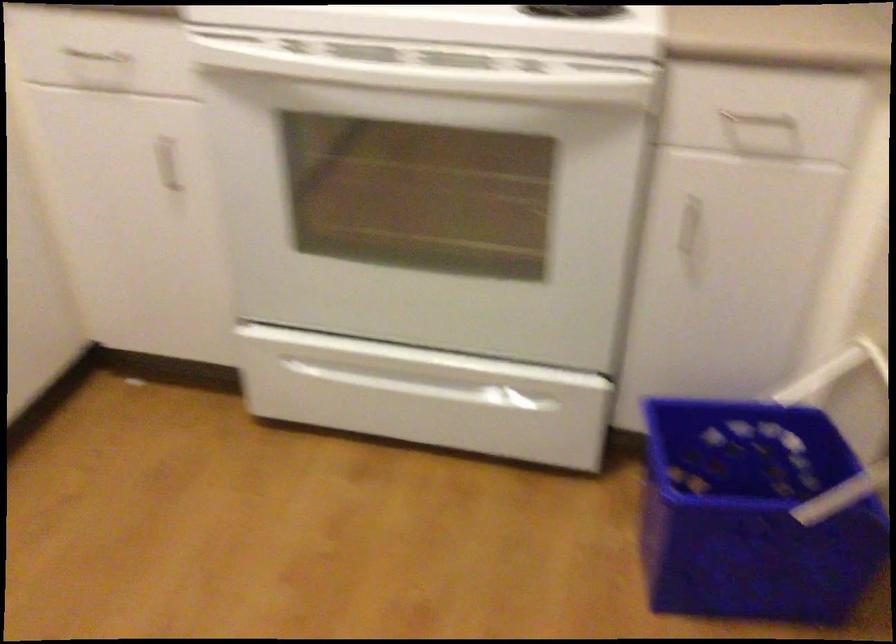
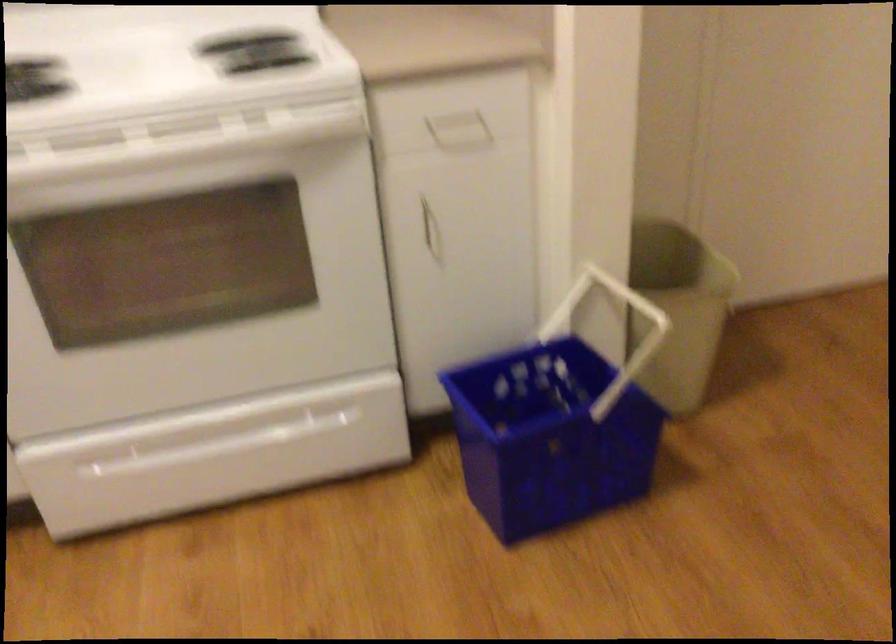
Locate, in the second image, the point that corresponds to [442,82] in the first image.

(175, 143)